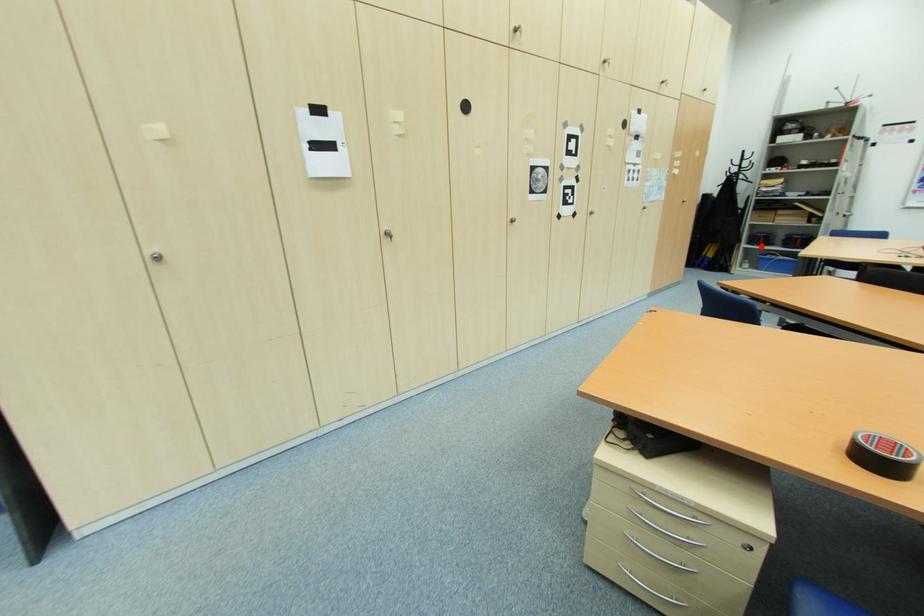
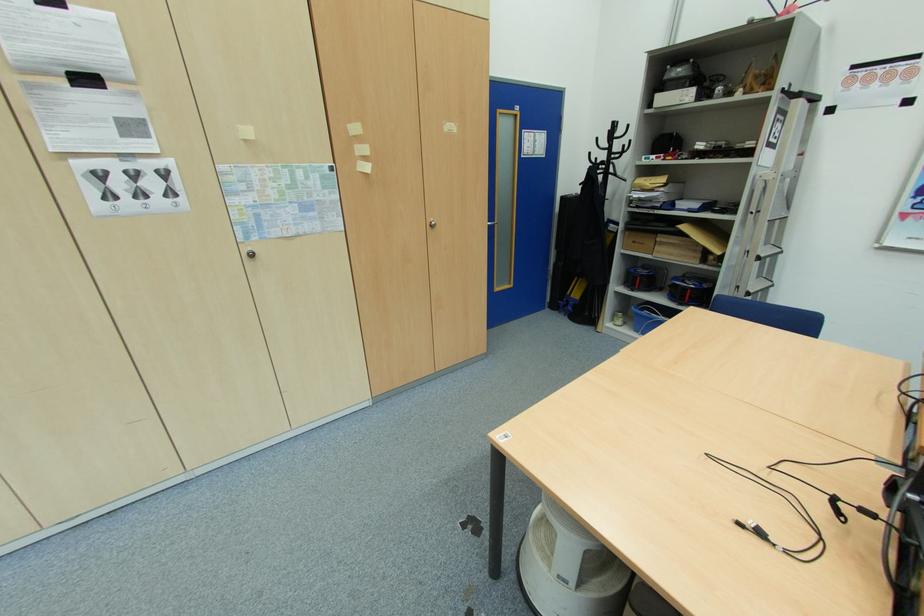
Question: A red point is marked in image1. In image2, is the corresponding 3D point closer to the camera or farther? Reply with the corresponding letter.

Choices:
 (A) The corresponding 3D point is closer.
 (B) The corresponding 3D point is farther.

Answer: (A)